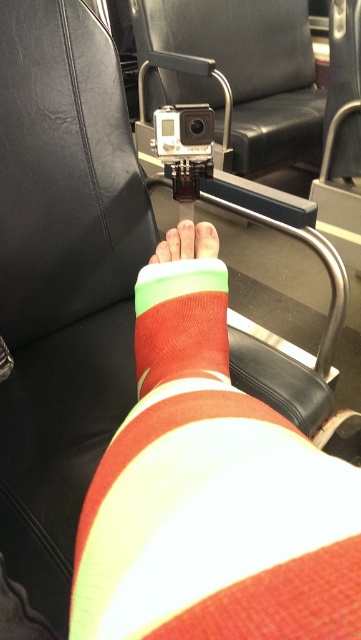
Question: Which object is positioned closest to the black plastic camera at center?

Choices:
 (A) black leather chair at upper center
 (B) multicolored bandage at center
 (C) matte red cast at center
 (D) red matte sock at center

Answer: (B)

Question: Is matte red cast at center positioned behind red matte sock at center?

Choices:
 (A) no
 (B) yes

Answer: (A)

Question: Does matte red cast at center have a larger size compared to black leather chair at upper center?

Choices:
 (A) yes
 (B) no

Answer: (B)

Question: Which point is farther to the camera?

Choices:
 (A) (144, 316)
 (B) (184, 120)

Answer: (B)

Question: Can you confirm if black leather chair at upper center is positioned to the left of black plastic camera at center?

Choices:
 (A) yes
 (B) no

Answer: (B)

Question: Which object is the farthest from the black plastic camera at center?

Choices:
 (A) matte red cast at center
 (B) black leather chair at upper center
 (C) red matte sock at center

Answer: (B)